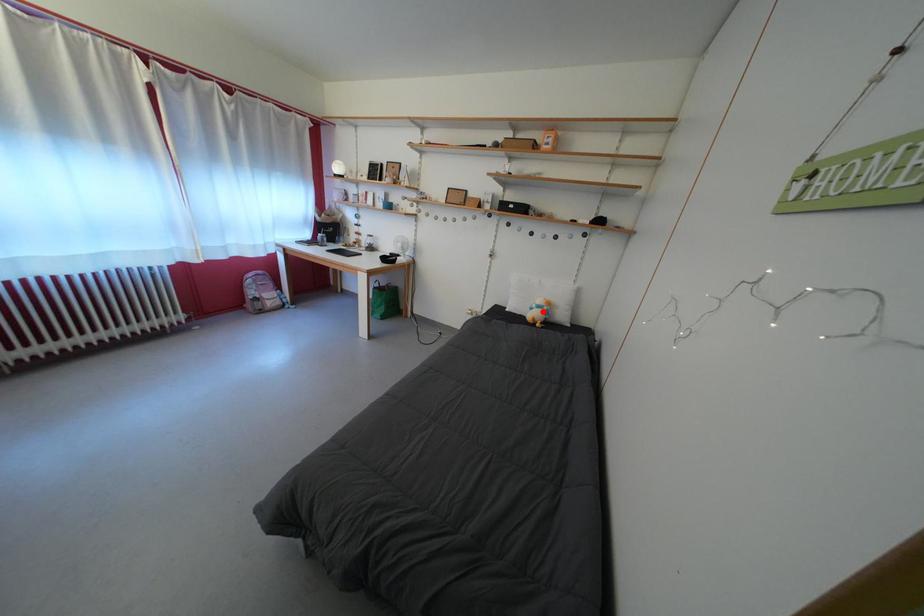
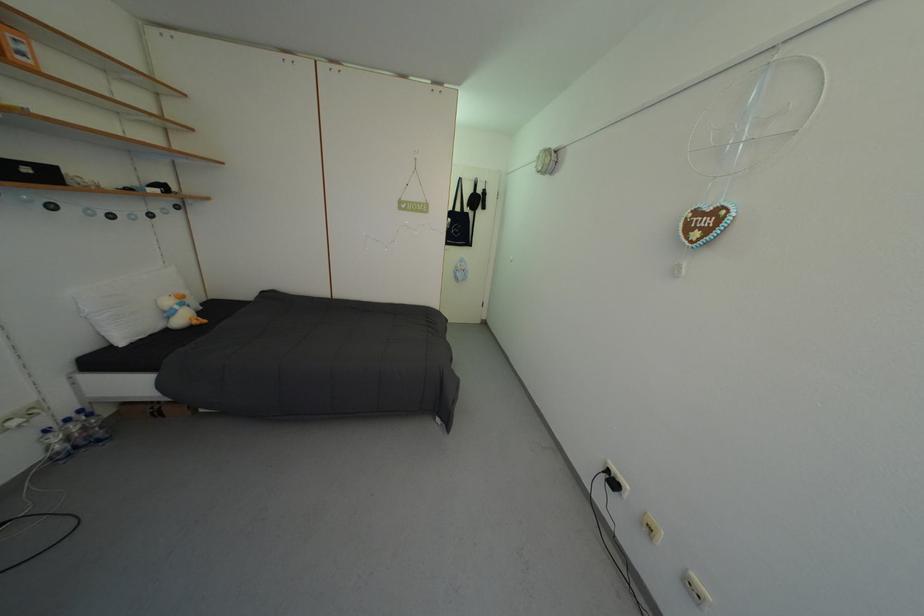
The point at the highlighted location is marked in the first image. Where is the corresponding point in the second image?

(186, 313)